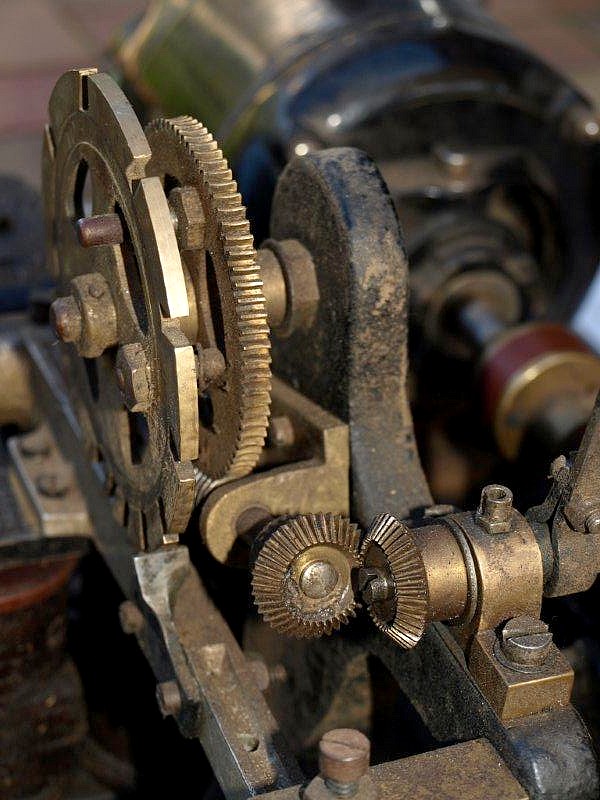
At what (x,y) coordinates should I click in order to perform the action: click on workshop tiled flooring. Please return your answer as a coordinate pair (x, y). This screenshot has width=600, height=800. Looking at the image, I should click on (35, 37).